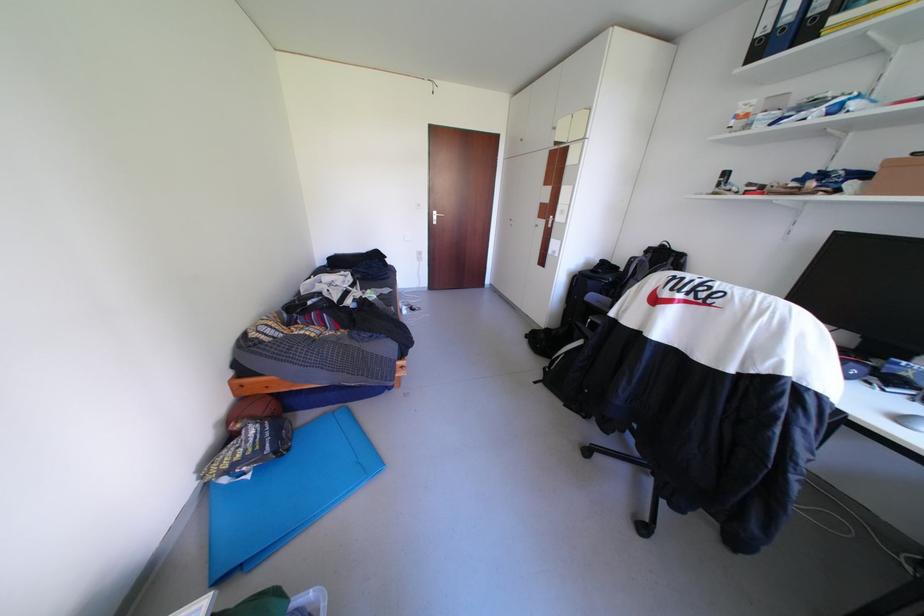
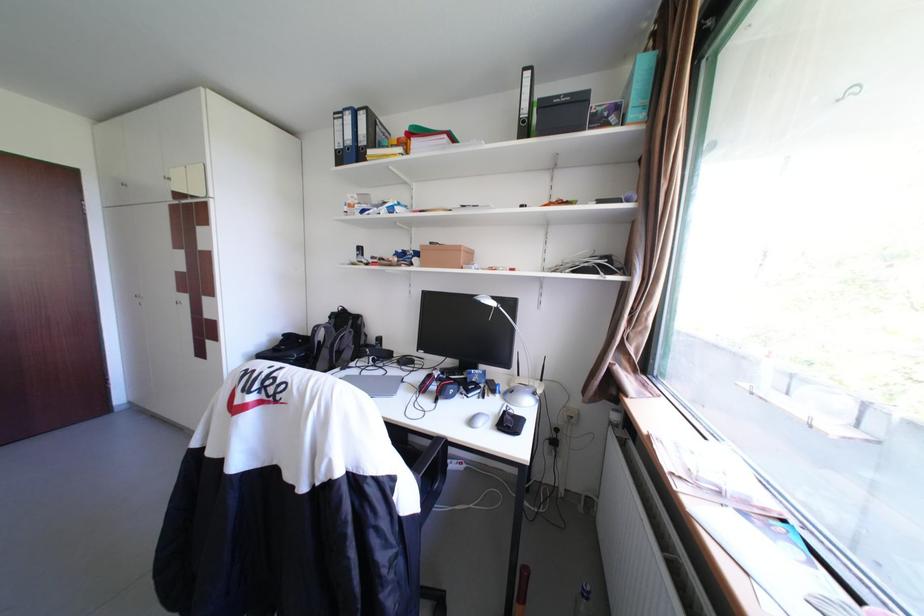
Locate, in the second image, the point that corresponds to point (526, 142) in the first image.

(130, 185)